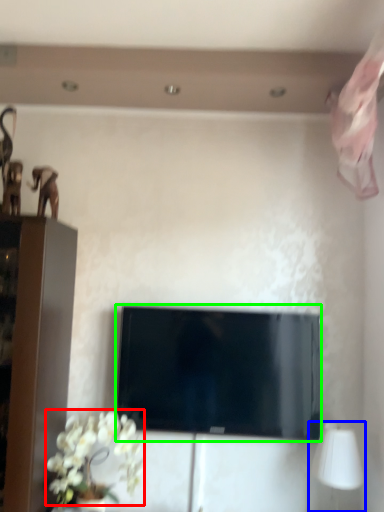
Question: Considering the real-world distances, which object is closest to flower (highlighted by a red box)? table lamp (highlighted by a blue box) or television (highlighted by a green box).

Choices:
 (A) table lamp
 (B) television

Answer: (B)